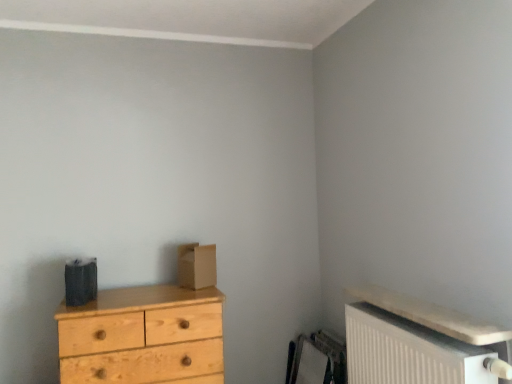
Question: Does natural wood chest of drawers at left have a smaller size compared to white textured radiator at lower right?

Choices:
 (A) yes
 (B) no

Answer: (B)

Question: Is natural wood chest of drawers at left beside white textured radiator at lower right?

Choices:
 (A) yes
 (B) no

Answer: (B)

Question: Is natural wood chest of drawers at left facing away from white textured radiator at lower right?

Choices:
 (A) yes
 (B) no

Answer: (B)

Question: Can you confirm if natural wood chest of drawers at left is thinner than white textured radiator at lower right?

Choices:
 (A) no
 (B) yes

Answer: (A)

Question: Can you confirm if natural wood chest of drawers at left is taller than white textured radiator at lower right?

Choices:
 (A) no
 (B) yes

Answer: (B)

Question: Can we say natural wood chest of drawers at left lies outside white textured radiator at lower right?

Choices:
 (A) no
 (B) yes

Answer: (B)

Question: Is white textured radiator at lower right to the right of natural wood chest of drawers at left from the viewer's perspective?

Choices:
 (A) yes
 (B) no

Answer: (A)

Question: Could you tell me if white textured radiator at lower right is facing natural wood chest of drawers at left?

Choices:
 (A) yes
 (B) no

Answer: (A)

Question: Considering the relative sizes of white textured radiator at lower right and natural wood chest of drawers at left in the image provided, is white textured radiator at lower right thinner than natural wood chest of drawers at left?

Choices:
 (A) no
 (B) yes

Answer: (B)

Question: Considering the relative sizes of white textured radiator at lower right and natural wood chest of drawers at left in the image provided, is white textured radiator at lower right taller than natural wood chest of drawers at left?

Choices:
 (A) no
 (B) yes

Answer: (A)

Question: From a real-world perspective, does white textured radiator at lower right sit lower than natural wood chest of drawers at left?

Choices:
 (A) yes
 (B) no

Answer: (B)

Question: Would you say white textured radiator at lower right is outside natural wood chest of drawers at left?

Choices:
 (A) no
 (B) yes

Answer: (B)

Question: Is brown cardboard box at center thinner than white textured radiator at lower right?

Choices:
 (A) yes
 (B) no

Answer: (A)